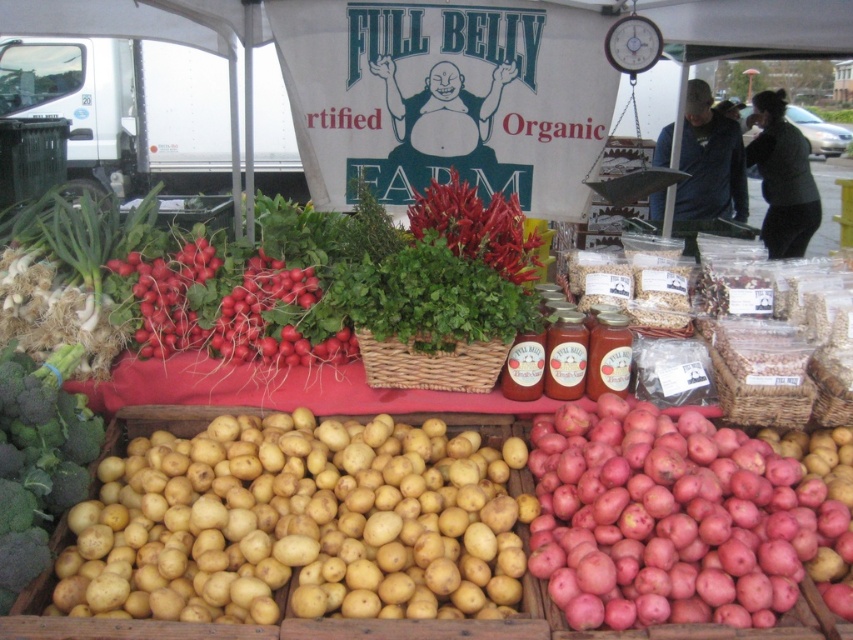
Question: Can you confirm if red matte potatoes at lower right is positioned below bright red chili peppers at center?

Choices:
 (A) yes
 (B) no

Answer: (A)

Question: Which of the following is the farthest from the observer?

Choices:
 (A) (59, 282)
 (B) (463, 243)

Answer: (A)

Question: Is red matte radish at center positioned at the back of green leafy broccoli at lower left?

Choices:
 (A) no
 (B) yes

Answer: (B)

Question: Which of the following is the farthest from the observer?

Choices:
 (A) click(262, 272)
 (B) click(476, 196)
 (C) click(576, 600)

Answer: (B)

Question: Is red matte potatoes at lower right positioned behind bright red chili peppers at center?

Choices:
 (A) yes
 (B) no

Answer: (B)

Question: Which is farther from the green leafy broccoli at lower left?

Choices:
 (A) green leafy vegetables at left
 (B) yellow matte potatoes at lower left
 (C) red matte radish at center
 (D) bright red chili peppers at center

Answer: (D)